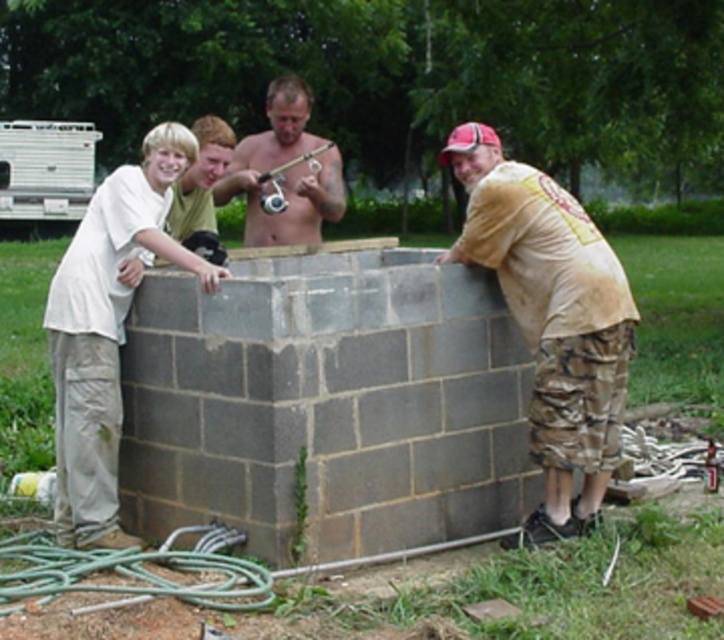
Question: Which point is closer to the camera?

Choices:
 (A) white cotton shirt at left
 (B) shiny metallic fishing rod at center
 (C) tan/camouflage pants at right

Answer: (A)

Question: Which point is farther from the camera taking this photo?

Choices:
 (A) (266, 228)
 (B) (161, 192)

Answer: (A)

Question: Can you confirm if white cotton shirt at left is thinner than shiny metallic fishing rod at center?

Choices:
 (A) yes
 (B) no

Answer: (A)

Question: Can you confirm if white cotton shirt at left is wider than shiny metallic fishing rod at center?

Choices:
 (A) yes
 (B) no

Answer: (B)

Question: Can you confirm if white cotton shirt at left is wider than shiny metallic fishing rod at center?

Choices:
 (A) yes
 (B) no

Answer: (B)

Question: Which point is closer to the camera taking this photo?

Choices:
 (A) (306, 86)
 (B) (521, 172)

Answer: (B)